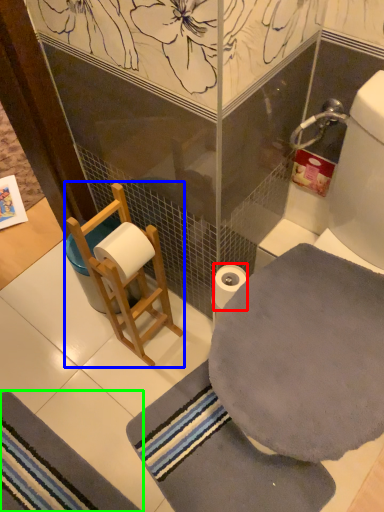
Question: Based on their relative distances, which object is farther from toilet paper (highlighted by a red box)? Choose from armchair (highlighted by a blue box) and bath mat (highlighted by a green box).

Choices:
 (A) armchair
 (B) bath mat

Answer: (B)